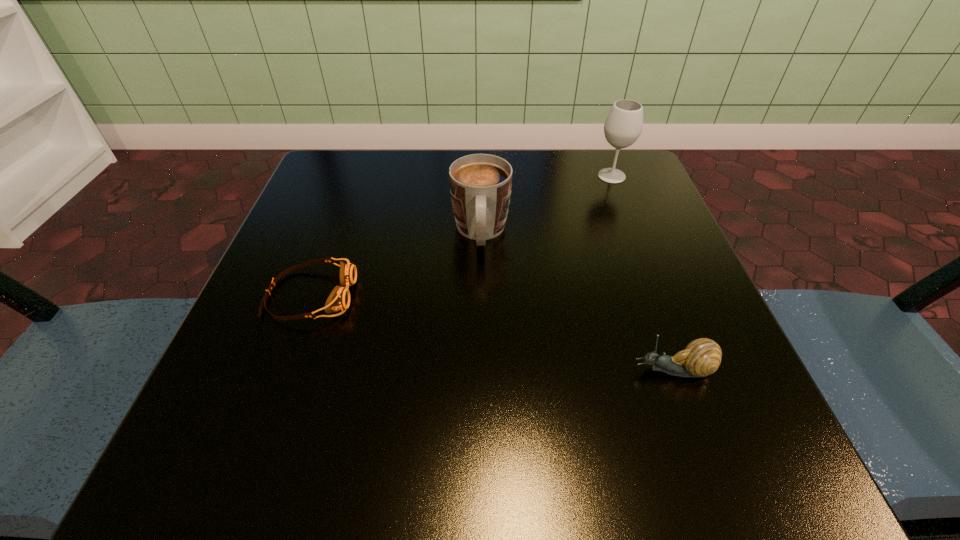
In order to click on blank area at the far edge in this screenshot , I will do pyautogui.click(x=390, y=184).

Where is `free space at the near edge of the desktop`? This screenshot has height=540, width=960. free space at the near edge of the desktop is located at coordinates (x=539, y=427).

Identify the location of vacant area at the left edge of the desktop. This screenshot has height=540, width=960. pyautogui.click(x=340, y=247).

In the image, there is a desktop. What are the coordinates of `vacant space at the right edge` in the screenshot? It's located at (656, 289).

I want to click on vacant space at the far left corner, so click(319, 171).

This screenshot has width=960, height=540. In order to click on free spot at the near left corner of the desktop in this screenshot , I will do `click(180, 471)`.

Image resolution: width=960 pixels, height=540 pixels. In the image, there is a desktop. In order to click on vacant space at the far right corner in this screenshot , I will do `click(598, 186)`.

The image size is (960, 540). Identify the location of free spot at the near right corner of the desktop. (739, 453).

The width and height of the screenshot is (960, 540). Identify the location of vacant space in between the mug and the leftmost object. (396, 264).

You are a GUI agent. You are given a task and a screenshot of the screen. Output one action in this format:
    pyautogui.click(x=<x>, y=<y>)
    Task: Click on the free space between the wineglass and the nearest object
    
    Given the screenshot: What is the action you would take?
    pyautogui.click(x=642, y=273)